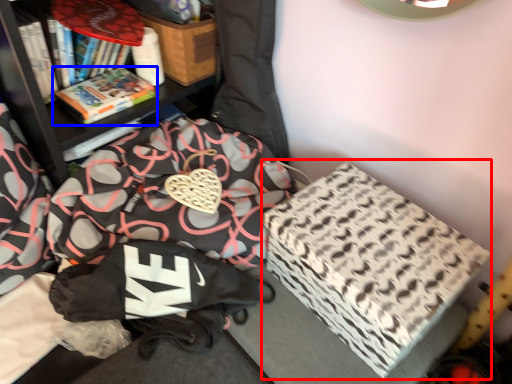
Question: Which object is further to the camera taking this photo, cardboard box (highlighted by a red box) or book (highlighted by a blue box)?

Choices:
 (A) cardboard box
 (B) book

Answer: (B)